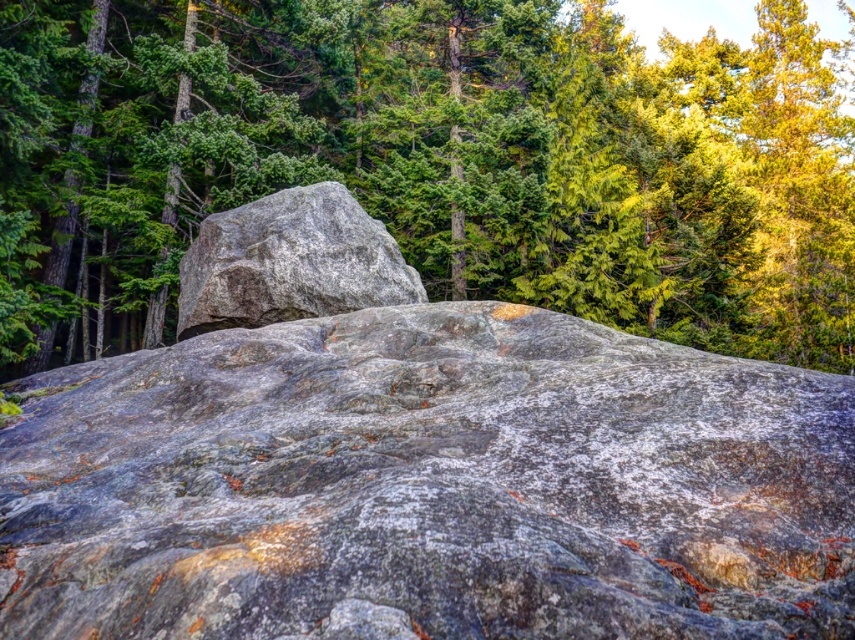
You are standing in front of the large rock formation and want to take a photo. There are two points on the rock that you want to focus on. The first point is at coordinates point (77, 417) and the second point is at point (411, 275). Which point is closer to your camera?

Point (77, 417) is closer to the camera than point (411, 275).

You are standing in front of the gray rough boulder at center and want to see if you can fit a picnic blanket between it and the green textured tree at upper center. Considering the width of the tree is larger than the boulder, can you estimate if there is enough space for the blanket?

The green textured tree at upper center is wider than the gray rough boulder at center, so there might be sufficient space between them to place a picnic blanket.